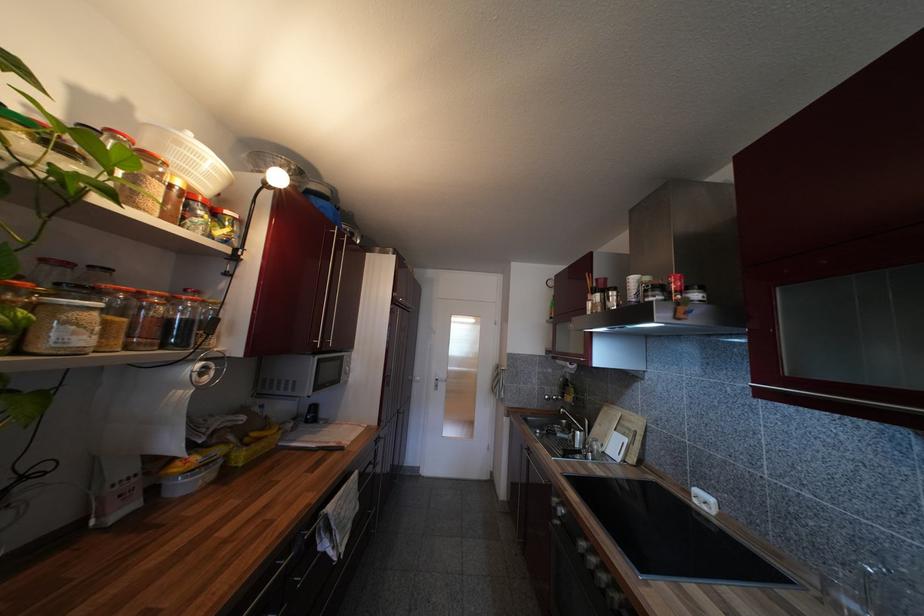
Find the location of a particular element. faucet handle is located at coordinates (570, 405).